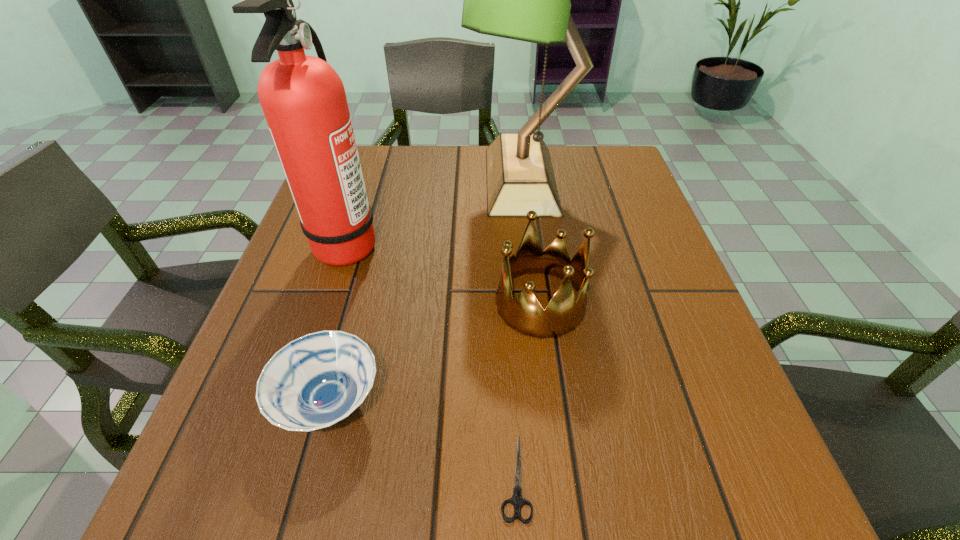
Image resolution: width=960 pixels, height=540 pixels. In the image, there is a desktop. What are the coordinates of `vacant region at the left edge` in the screenshot? It's located at (349, 268).

In the image, there is a desktop. At what (x,y) coordinates should I click in order to perform the action: click on vacant space at the right edge. Please return your answer as a coordinate pair (x, y). Image resolution: width=960 pixels, height=540 pixels. Looking at the image, I should click on (738, 423).

Where is `free location at the near right corner of the desktop`? Image resolution: width=960 pixels, height=540 pixels. free location at the near right corner of the desktop is located at coordinates (733, 468).

Where is `free space between the fourth tallest object and the table lamp`? The image size is (960, 540). free space between the fourth tallest object and the table lamp is located at coordinates (425, 292).

Locate an element on the screen. This screenshot has height=540, width=960. free space between the soup bowl and the fire extinguisher is located at coordinates (338, 323).

Where is `unoccupied position between the shears and the crown`? unoccupied position between the shears and the crown is located at coordinates (528, 390).

I want to click on free spot between the third tallest object and the fire extinguisher, so click(x=444, y=273).

Where is `free space between the crown and the soup bowl`? The image size is (960, 540). free space between the crown and the soup bowl is located at coordinates (435, 353).

Image resolution: width=960 pixels, height=540 pixels. Identify the location of vacant area that lies between the soup bowl and the crown. click(435, 353).

Locate an element on the screen. This screenshot has width=960, height=540. object that stands as the second closest to the fourth tallest object is located at coordinates (517, 500).